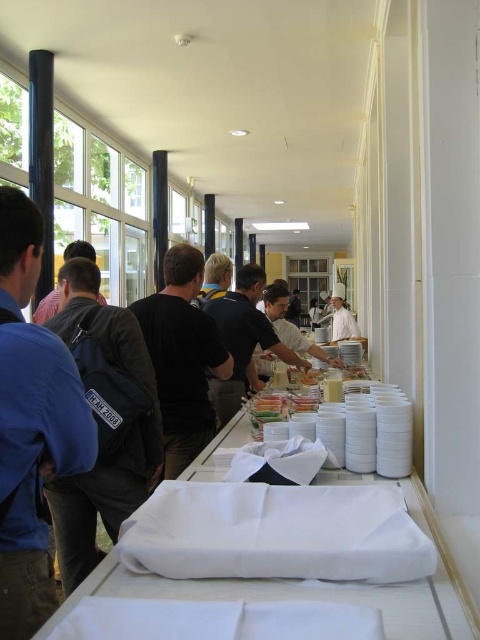
You are a guest at a buffet and need to grab a plate. You see the white cloth at center and the black matte shirt at center. Which object is closer to you?

The white cloth at center is closer to you since it is in front of the black matte shirt at center.

You are a guest at the buffet and see the black matte shirt at center and the white fabric at center on the table. Which item is located to the left of the other?

The black matte shirt at center is positioned on the left side of white fabric at center, so the black matte shirt at center is to the left of the white fabric at center.

You are a photographer standing in front of the buffet table and see the blue shirt at left. You want to take a photo of the food without the blue shirt in the frame. Can you move sideways to avoid it?

The blue shirt at left and camera are 38.53 inches apart. Moving sideways by at least 38.53 inches away from the blue shirt at left would allow you to avoid it in the frame.